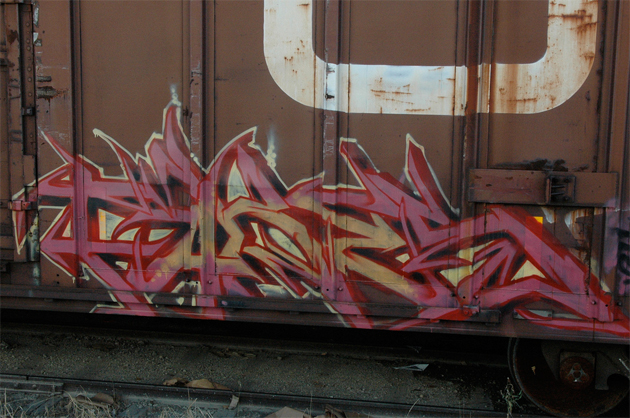
Locate an element on the screen. Image resolution: width=630 pixels, height=418 pixels. tiny plant is located at coordinates (508, 397).